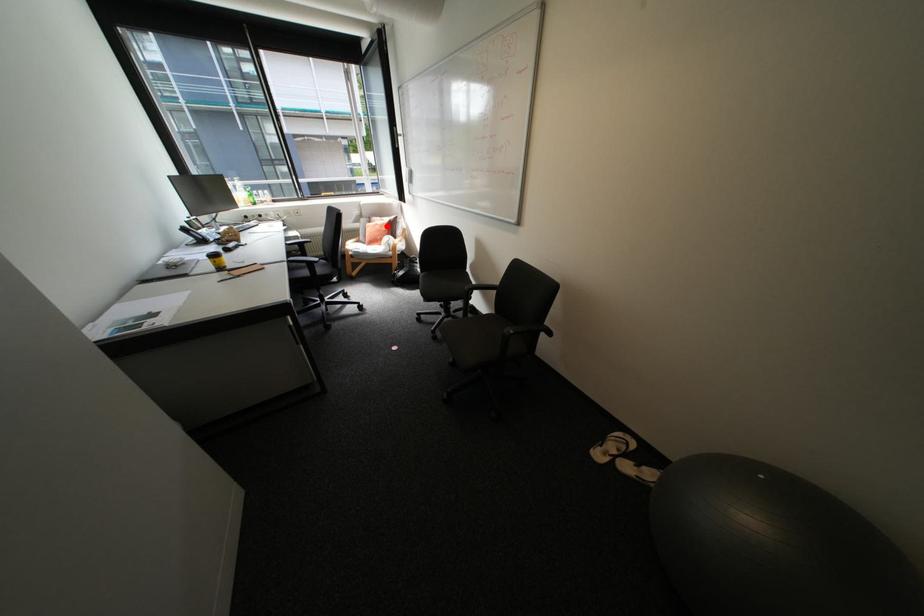
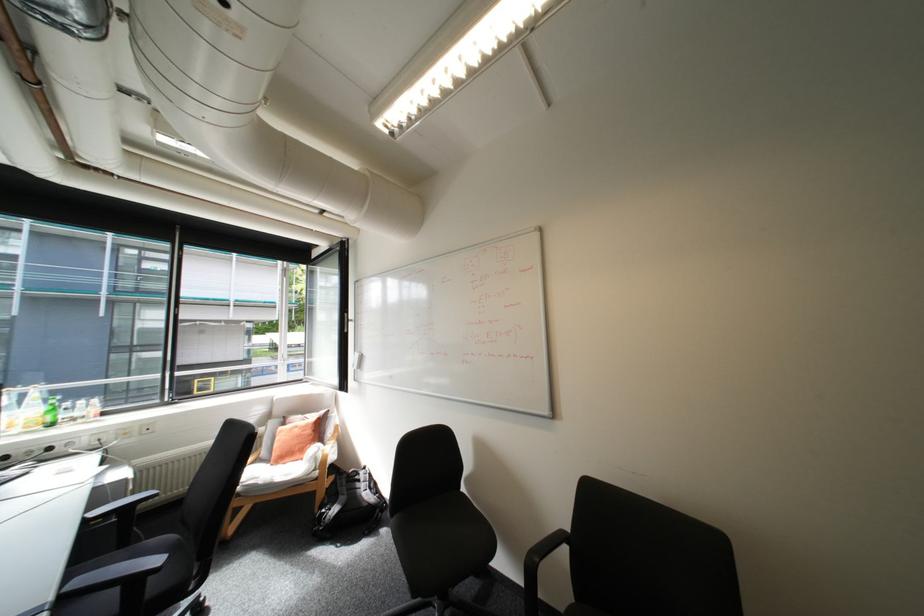
Where in the second image is the point corresponding to the highlighted location from the first image?

(307, 429)